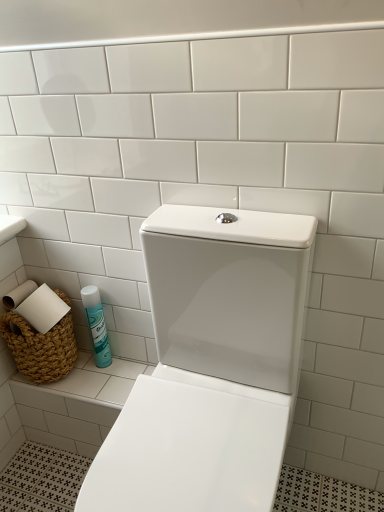
You are a GUI agent. You are given a task and a screenshot of the screen. Output one action in this format:
    pyautogui.click(x=<x>, y=<y>)
    Task: Click on the free spot to the left of blue glossy can at lower left
    
    Given the screenshot: What is the action you would take?
    pyautogui.click(x=71, y=374)